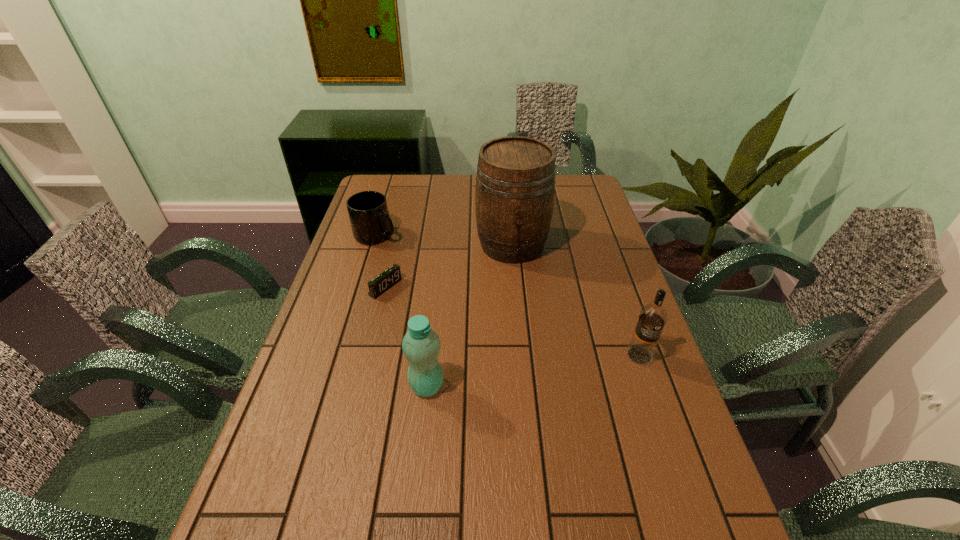
Identify the location of free space on the desktop that is between the bottle and the vodka and is positioned on the side of the tallest object near the bung hole. (536, 370).

Where is `vacant space on the desktop that is between the nearest object and the second nearest object and is positioned with the handle on the side of the second shortest object`? The height and width of the screenshot is (540, 960). vacant space on the desktop that is between the nearest object and the second nearest object and is positioned with the handle on the side of the second shortest object is located at coordinates (536, 370).

You are a GUI agent. You are given a task and a screenshot of the screen. Output one action in this format:
    pyautogui.click(x=<x>, y=<y>)
    Task: Click on the free space on the desktop that is between the bottle and the vodka and is positioned on the front-facing side of the shortest object
    
    Given the screenshot: What is the action you would take?
    pyautogui.click(x=530, y=371)